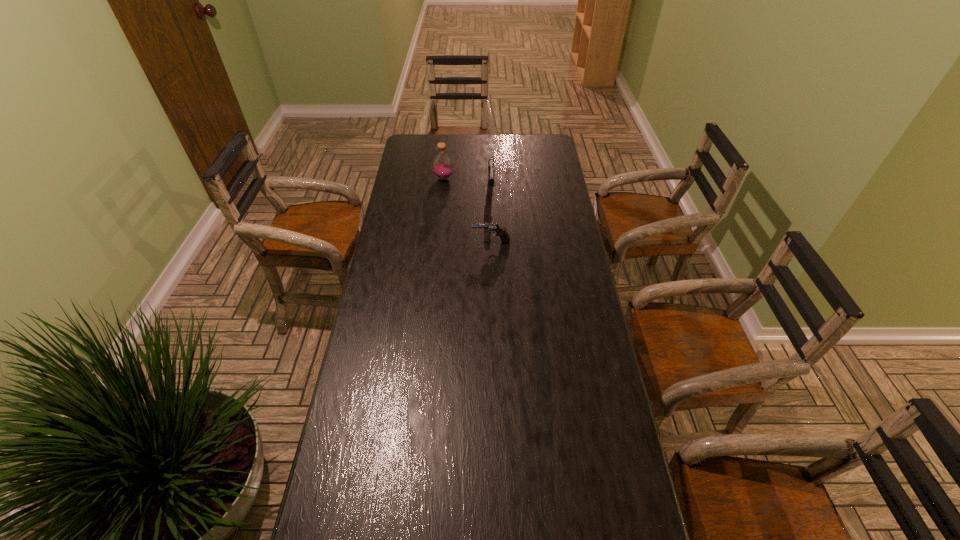
This screenshot has height=540, width=960. In order to click on free spot located 0.340m at the barrel of the shortest object in this screenshot , I will do click(384, 242).

You are a GUI agent. You are given a task and a screenshot of the screen. Output one action in this format:
    pyautogui.click(x=<x>, y=<y>)
    Task: Click on the object at the left edge
    This screenshot has height=540, width=960.
    Given the screenshot: What is the action you would take?
    pyautogui.click(x=442, y=165)

In the image, there is a desktop. Where is `vacant space at the far edge`? This screenshot has height=540, width=960. vacant space at the far edge is located at coordinates (457, 136).

This screenshot has width=960, height=540. In the image, there is a desktop. Find the location of `vacant area at the left edge`. vacant area at the left edge is located at coordinates (356, 381).

Where is `free point at the right edge`? Image resolution: width=960 pixels, height=540 pixels. free point at the right edge is located at coordinates (553, 324).

Image resolution: width=960 pixels, height=540 pixels. I want to click on vacant area that lies between the nearer pistol and the bottle, so click(468, 210).

Image resolution: width=960 pixels, height=540 pixels. I want to click on vacant point located between the nearest object and the taller pistol, so click(492, 217).

Locate an element on the screen. This screenshot has width=960, height=540. free space between the tallest object and the nearer pistol is located at coordinates (468, 210).

Identify the location of vacant space in between the nearest object and the taller pistol. (492, 217).

Locate an element on the screen. free spot between the tallest object and the second shortest object is located at coordinates (468, 185).